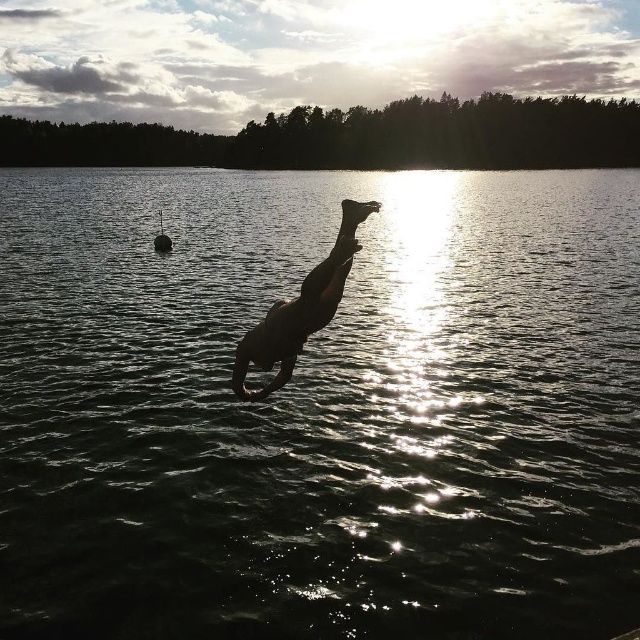
Between dark water at center and black matte person at center, which one has more height?

With more height is dark water at center.

Is point (131, 422) more distant than point (291, 355)?

That is True.

The image size is (640, 640). I want to click on dark water at center, so click(320, 406).